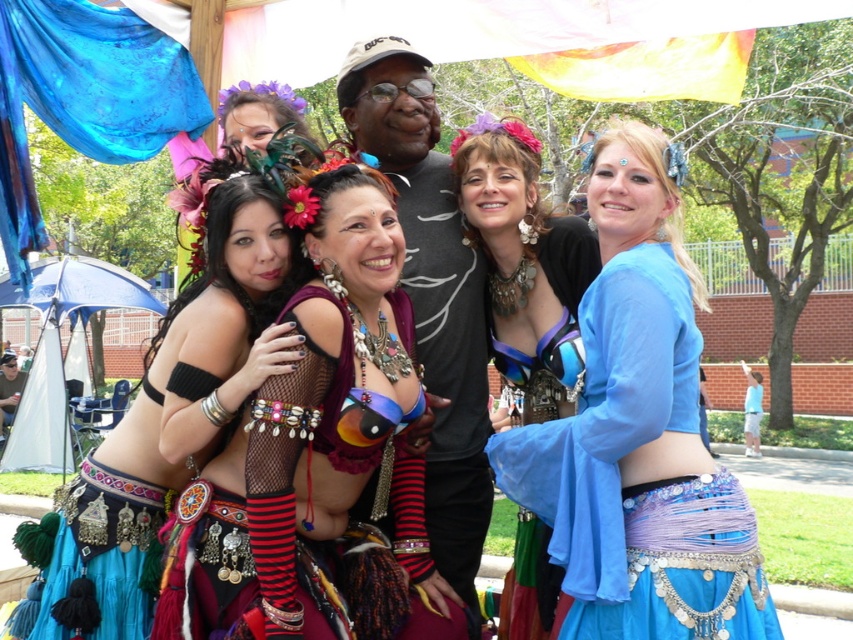
You are a photographer trying to capture the entire scene in one shot. You notice the shiny metallic belly dancer at center and the shiny blue fabric at center. Which object should you focus on to ensure both are in frame without cropping?

The shiny metallic belly dancer at center is not as tall as the shiny blue fabric at center, so focusing on the taller shiny blue fabric at center will ensure both are in frame without cropping.